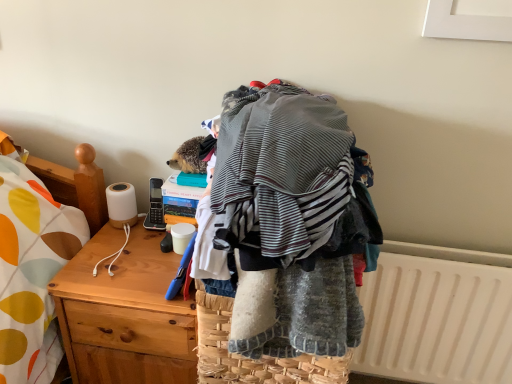
Question: Does woven straw picnic basket at center come in front of white plastic radiator at lower right?

Choices:
 (A) no
 (B) yes

Answer: (B)

Question: Would you say woven straw picnic basket at center contains white plastic radiator at lower right?

Choices:
 (A) yes
 (B) no

Answer: (B)

Question: Is woven straw picnic basket at center facing away from white plastic radiator at lower right?

Choices:
 (A) yes
 (B) no

Answer: (B)

Question: Could you tell me if woven straw picnic basket at center is facing white plastic radiator at lower right?

Choices:
 (A) yes
 (B) no

Answer: (B)

Question: Would you say woven straw picnic basket at center is outside white plastic radiator at lower right?

Choices:
 (A) no
 (B) yes

Answer: (B)

Question: From a real-world perspective, is white plastic radiator at lower right positioned above or below wooden desk at left?

Choices:
 (A) above
 (B) below

Answer: (A)

Question: Looking at their shapes, would you say white plastic radiator at lower right is wider or thinner than wooden desk at left?

Choices:
 (A) thin
 (B) wide

Answer: (A)

Question: Is white plastic radiator at lower right spatially inside wooden desk at left, or outside of it?

Choices:
 (A) inside
 (B) outside

Answer: (B)

Question: In the image, is white plastic radiator at lower right on the left side or the right side of wooden desk at left?

Choices:
 (A) left
 (B) right

Answer: (B)

Question: Would you say wooden desk at left is to the left or to the right of woven straw picnic basket at center in the picture?

Choices:
 (A) right
 (B) left

Answer: (B)

Question: From their relative heights in the image, would you say wooden desk at left is taller or shorter than woven straw picnic basket at center?

Choices:
 (A) short
 (B) tall

Answer: (B)

Question: Considering the positions of point (75, 337) and point (252, 365), is point (75, 337) closer or farther from the camera than point (252, 365)?

Choices:
 (A) closer
 (B) farther

Answer: (B)

Question: Do you think wooden desk at left is within woven straw picnic basket at center, or outside of it?

Choices:
 (A) inside
 (B) outside

Answer: (B)

Question: From the image's perspective, relative to white plastic radiator at lower right, is woven straw picnic basket at center above or below?

Choices:
 (A) above
 (B) below

Answer: (A)

Question: In terms of width, does woven straw picnic basket at center look wider or thinner when compared to white plastic radiator at lower right?

Choices:
 (A) thin
 (B) wide

Answer: (B)